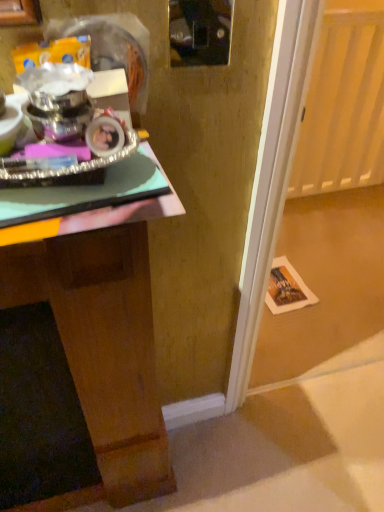
Question: Considering the relative positions of transparent glass door at lower right and wooden desk at left in the image provided, is transparent glass door at lower right in front of wooden desk at left?

Choices:
 (A) no
 (B) yes

Answer: (A)

Question: Could you tell me if transparent glass door at lower right is turned towards wooden desk at left?

Choices:
 (A) yes
 (B) no

Answer: (B)

Question: Is wooden desk at left at the back of transparent glass door at lower right?

Choices:
 (A) yes
 (B) no

Answer: (B)

Question: Is transparent glass door at lower right positioned far away from wooden desk at left?

Choices:
 (A) no
 (B) yes

Answer: (B)

Question: Can you confirm if transparent glass door at lower right is positioned to the right of wooden desk at left?

Choices:
 (A) no
 (B) yes

Answer: (B)

Question: Considering the relative sizes of transparent glass door at lower right and wooden desk at left in the image provided, is transparent glass door at lower right wider than wooden desk at left?

Choices:
 (A) no
 (B) yes

Answer: (A)

Question: Does wooden desk at left have a smaller size compared to transparent glass door at lower right?

Choices:
 (A) yes
 (B) no

Answer: (B)

Question: Considering the relative positions of wooden desk at left and transparent glass door at lower right in the image provided, is wooden desk at left to the right of transparent glass door at lower right from the viewer's perspective?

Choices:
 (A) yes
 (B) no

Answer: (B)

Question: Is wooden desk at left bigger than transparent glass door at lower right?

Choices:
 (A) yes
 (B) no

Answer: (A)

Question: Is wooden desk at left turned away from transparent glass door at lower right?

Choices:
 (A) yes
 (B) no

Answer: (B)

Question: Considering the relative sizes of wooden desk at left and transparent glass door at lower right in the image provided, is wooden desk at left taller than transparent glass door at lower right?

Choices:
 (A) no
 (B) yes

Answer: (A)

Question: From the image's perspective, is wooden desk at left over transparent glass door at lower right?

Choices:
 (A) yes
 (B) no

Answer: (B)

Question: Considering the relative positions of wooden desk at left and transparent glass door at lower right in the image provided, is wooden desk at left to the left or to the right of transparent glass door at lower right?

Choices:
 (A) right
 (B) left

Answer: (B)